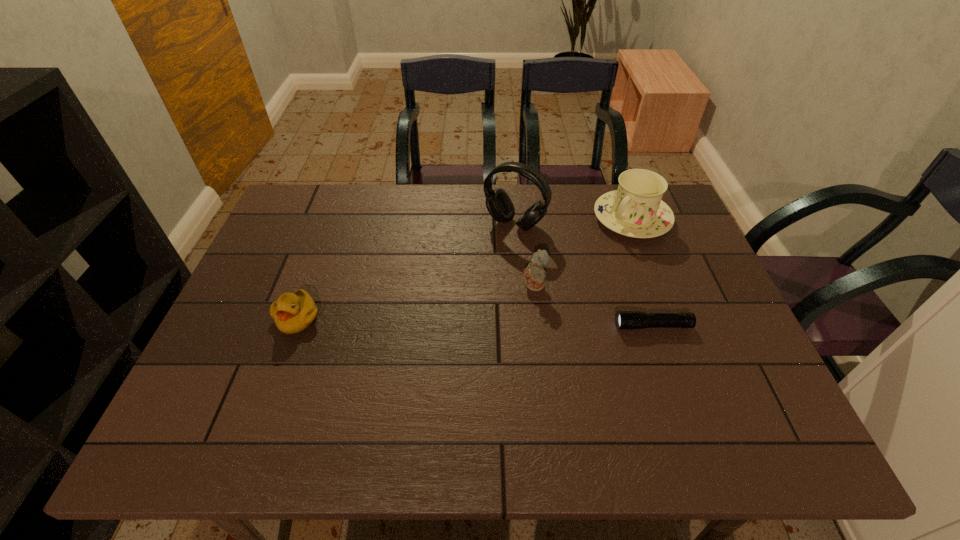
I want to click on vacant space on the desktop that is between the duckling and the shortest object and is positioned on the front-facing side of the teddy bear, so click(x=465, y=322).

What are the coordinates of `vacant space on the desktop that is between the leftmost object and the shortest object and is positioned on the handle side of the chinaware` in the screenshot? It's located at (518, 323).

Locate an element on the screen. This screenshot has height=540, width=960. vacant space on the desktop that is between the duckling and the flashlight and is positioned on the earcups of the headset is located at coordinates (443, 321).